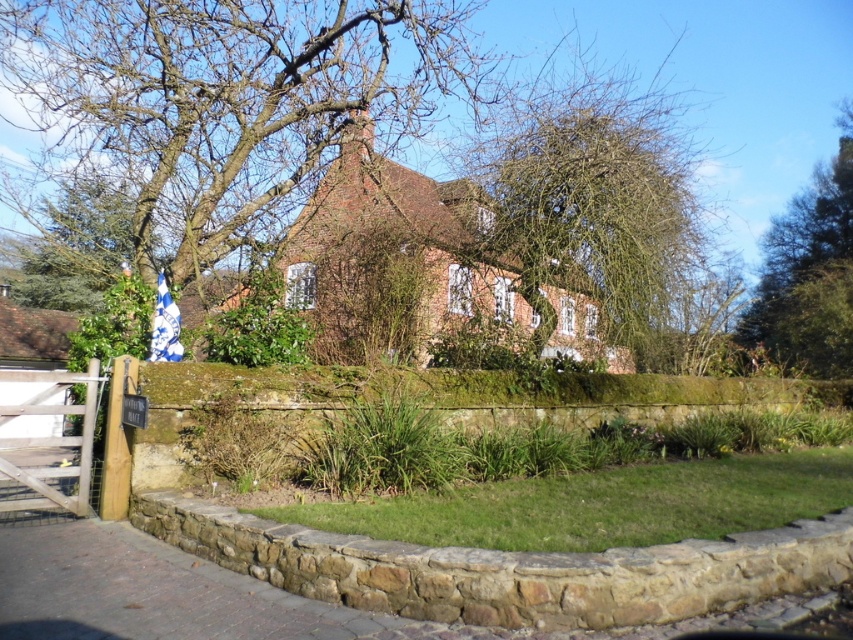
Question: Which object is the farthest from the green leafy tree at upper right?

Choices:
 (A) bare branches at center
 (B) bare branches at upper center

Answer: (B)

Question: Is bare branches at center to the left of green leafy tree at upper right from the viewer's perspective?

Choices:
 (A) no
 (B) yes

Answer: (B)

Question: Can you confirm if bare branches at upper center is positioned below green leafy tree at upper right?

Choices:
 (A) yes
 (B) no

Answer: (B)

Question: Which of the following is the farthest from the observer?

Choices:
 (A) green leafy tree at upper right
 (B) bare branches at center

Answer: (A)

Question: Which of the following is the closest to the observer?

Choices:
 (A) (811, 230)
 (B) (28, 92)
 (C) (631, 282)

Answer: (C)

Question: Can you confirm if bare branches at upper center is thinner than bare branches at center?

Choices:
 (A) no
 (B) yes

Answer: (A)